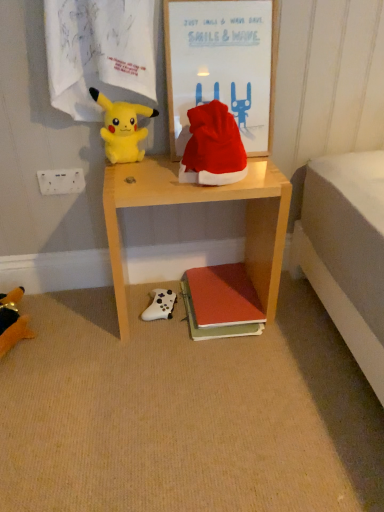
You are a GUI agent. You are given a task and a screenshot of the screen. Output one action in this format:
    pyautogui.click(x=<x>, y=<y>)
    Task: Click on the free space in front of yellow plush toy at upper left, which ranks as the 3th toy in bottom-to-top order
    
    Given the screenshot: What is the action you would take?
    (140, 174)